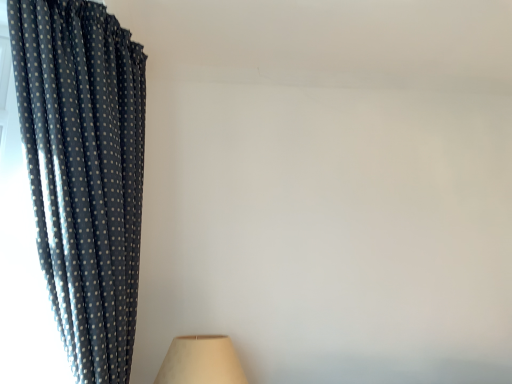
This screenshot has width=512, height=384. What are the coordinates of `beige fabric lampshade at lower left` in the screenshot? It's located at (201, 361).

What is the approximate height of beige fabric lampshade at lower left?

The height of beige fabric lampshade at lower left is 9.42 inches.

This screenshot has height=384, width=512. What do you see at coordinates (201, 361) in the screenshot?
I see `beige fabric lampshade at lower left` at bounding box center [201, 361].

Describe the element at coordinates (84, 172) in the screenshot. This screenshot has width=512, height=384. I see `dark blue polka dot fabric at left` at that location.

Find the location of a particular element. Image resolution: width=512 pixels, height=384 pixels. dark blue polka dot fabric at left is located at coordinates (84, 172).

The image size is (512, 384). Find the location of `beige fabric lampshade at lower left`. beige fabric lampshade at lower left is located at coordinates (201, 361).

Which is more to the right, beige fabric lampshade at lower left or dark blue polka dot fabric at left?

beige fabric lampshade at lower left is more to the right.

Does beige fabric lampshade at lower left lie behind dark blue polka dot fabric at left?

That is True.

Which is closer to the camera, (x=222, y=345) or (x=119, y=119)?

Point (x=222, y=345).

Looking at this image, from the image's perspective, is beige fabric lampshade at lower left on top of dark blue polka dot fabric at left?

Incorrect, from the image's perspective, beige fabric lampshade at lower left is lower than dark blue polka dot fabric at left.

From a real-world perspective, is beige fabric lampshade at lower left positioned above or below dark blue polka dot fabric at left?

beige fabric lampshade at lower left is below dark blue polka dot fabric at left.

Looking at this image, looking at their sizes, would you say beige fabric lampshade at lower left is wider or thinner than dark blue polka dot fabric at left?

Considering their sizes, beige fabric lampshade at lower left looks slimmer than dark blue polka dot fabric at left.

In terms of height, does beige fabric lampshade at lower left look taller or shorter compared to dark blue polka dot fabric at left?

Considering their sizes, beige fabric lampshade at lower left has less height than dark blue polka dot fabric at left.

Can you confirm if beige fabric lampshade at lower left is smaller than dark blue polka dot fabric at left?

Yes.

Choose the correct answer: Is beige fabric lampshade at lower left inside dark blue polka dot fabric at left or outside it?

beige fabric lampshade at lower left is spatially situated outside dark blue polka dot fabric at left.

Is beige fabric lampshade at lower left in contact with dark blue polka dot fabric at left?

No, beige fabric lampshade at lower left is not next to dark blue polka dot fabric at left.

Does beige fabric lampshade at lower left turn towards dark blue polka dot fabric at left?

No.

How many degrees apart are the facing directions of beige fabric lampshade at lower left and dark blue polka dot fabric at left?

beige fabric lampshade at lower left and dark blue polka dot fabric at left are facing 0.000511 degrees away from each other.

Locate an element on the screen. lamp that is below the dark blue polka dot fabric at left (from the image's perspective) is located at coordinates (201, 361).

Can you confirm if dark blue polka dot fabric at left is positioned to the right of beige fabric lampshade at lower left?

In fact, dark blue polka dot fabric at left is to the left of beige fabric lampshade at lower left.

Considering their positions, is dark blue polka dot fabric at left located in front of or behind beige fabric lampshade at lower left?

Clearly, dark blue polka dot fabric at left is in front of beige fabric lampshade at lower left.

Considering the positions of points (115, 42) and (218, 366), is point (115, 42) closer to camera compared to point (218, 366)?

Yes, it is in front of point (218, 366).

From the image's perspective, is dark blue polka dot fabric at left over beige fabric lampshade at lower left?

Indeed, from the image's perspective, dark blue polka dot fabric at left is shown above beige fabric lampshade at lower left.

From a real-world perspective, is dark blue polka dot fabric at left physically located above or below beige fabric lampshade at lower left?

dark blue polka dot fabric at left is above beige fabric lampshade at lower left.

Which of these two, dark blue polka dot fabric at left or beige fabric lampshade at lower left, is wider?

Wider between the two is dark blue polka dot fabric at left.

Considering the relative sizes of dark blue polka dot fabric at left and beige fabric lampshade at lower left in the image provided, is dark blue polka dot fabric at left shorter than beige fabric lampshade at lower left?

In fact, dark blue polka dot fabric at left may be taller than beige fabric lampshade at lower left.

Considering the relative sizes of dark blue polka dot fabric at left and beige fabric lampshade at lower left in the image provided, is dark blue polka dot fabric at left bigger than beige fabric lampshade at lower left?

Yes, dark blue polka dot fabric at left is bigger than beige fabric lampshade at lower left.

Can we say dark blue polka dot fabric at left lies outside beige fabric lampshade at lower left?

Yes, dark blue polka dot fabric at left is not within beige fabric lampshade at lower left.

Would you say dark blue polka dot fabric at left is a long distance from beige fabric lampshade at lower left?

That's not correct — dark blue polka dot fabric at left is a little close to beige fabric lampshade at lower left.

Could you tell me if dark blue polka dot fabric at left is turned towards beige fabric lampshade at lower left?

No, dark blue polka dot fabric at left is not facing towards beige fabric lampshade at lower left.

Measure the distance between dark blue polka dot fabric at left and beige fabric lampshade at lower left.

They are 24.84 inches apart.

Find the location of a particular element. The height and width of the screenshot is (384, 512). curtain that is in front of the beige fabric lampshade at lower left is located at coordinates (84, 172).

Find the location of `lamp to the right of dark blue polka dot fabric at left`. lamp to the right of dark blue polka dot fabric at left is located at coordinates tap(201, 361).

Identify the location of curtain that appears in front of the beige fabric lampshade at lower left. (84, 172).